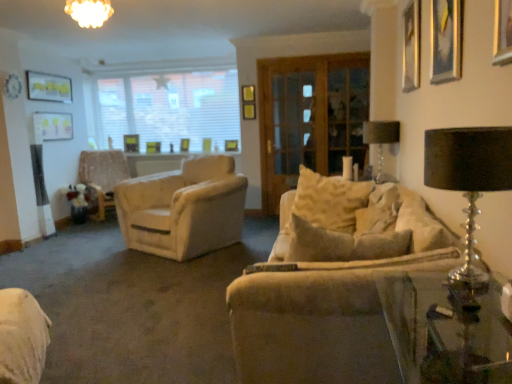
Question: Is gold metallic picture frame at upper left, the 3th picture frame positioned from the back, in front of or behind metallic gold picture frame at upper right, which appears as the first picture frame when viewed from the front, in the image?

Choices:
 (A) front
 (B) behind

Answer: (B)

Question: Based on their sizes in the image, would you say gold metallic picture frame at upper left, the 3th picture frame positioned from the back, is bigger or smaller than metallic gold picture frame at upper right, which appears as the first picture frame when viewed from the front?

Choices:
 (A) small
 (B) big

Answer: (A)

Question: Which object is positioned farthest from the matte white picture frame at upper left, the 4th picture frame when ordered from right to left?

Choices:
 (A) white blinds at upper center
 (B) white frosted glass chandelier at upper center
 (C) beige fabric couch at center
 (D) metallic gold picture frame at upper right, which is the fifth picture frame from back to front
 (E) metallic silver picture frame at upper right, the 1th picture frame from the right

Answer: (D)

Question: Estimate the real-world distances between objects in this image. Which object is closer to the light beige fabric armchair at left?

Choices:
 (A) wooden screen door at center
 (B) black glass table lamp at right, the 1th table lamp when ordered from front to back
 (C) metallic silver picture frame at upper right, the 1th picture frame from the right
 (D) white blinds at upper center
 (E) beige fabric couch at center

Answer: (D)